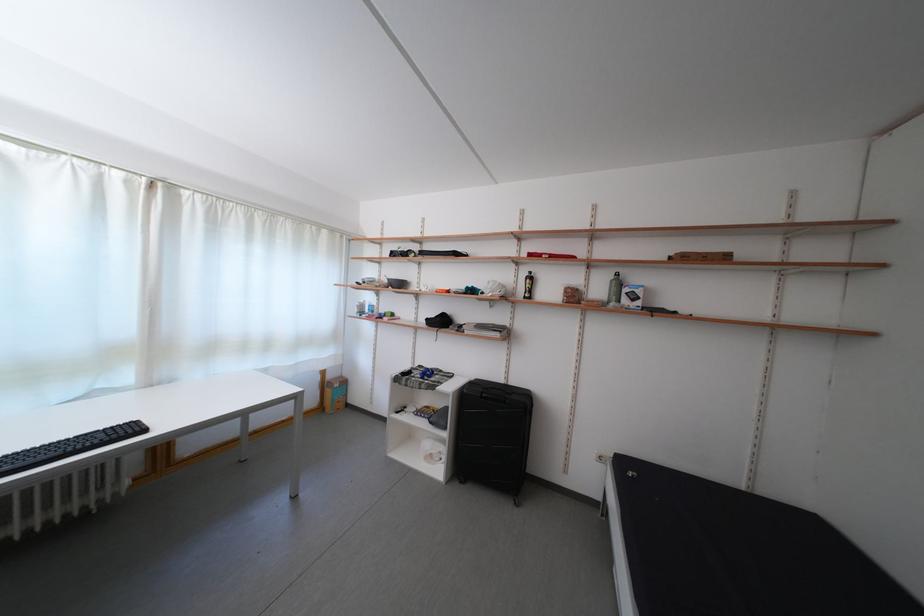
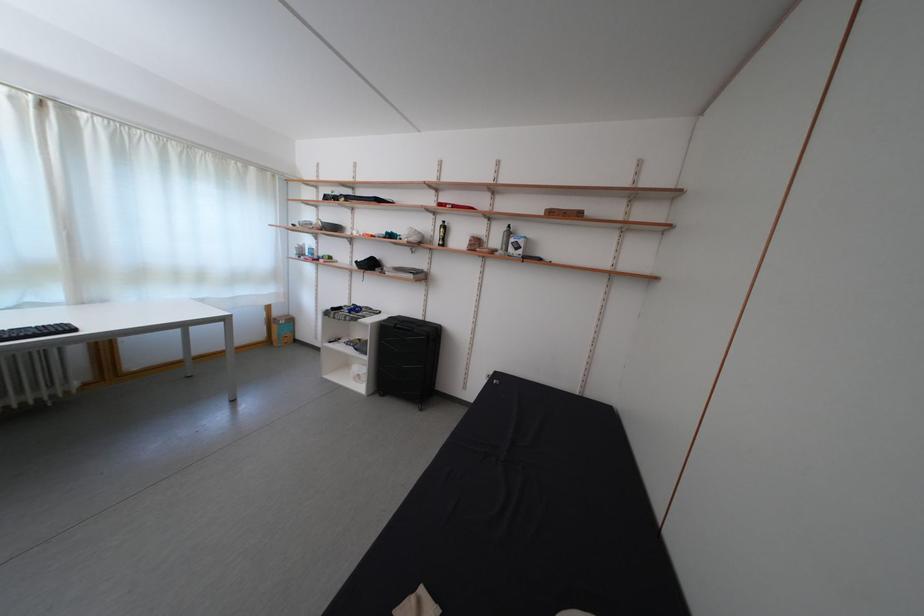
Locate, in the second image, the point that corresponds to the point at 525,294 in the first image.

(442, 241)